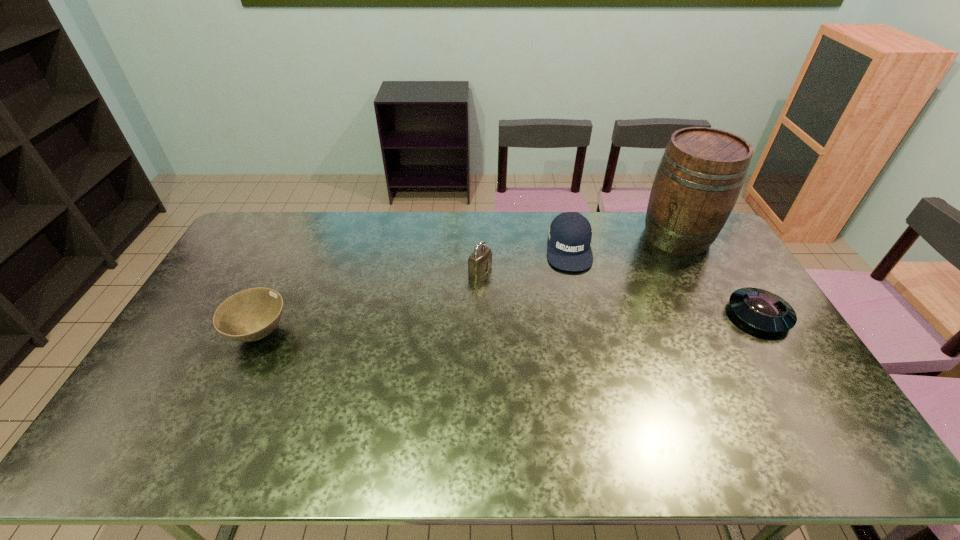
You are a GUI agent. You are given a task and a screenshot of the screen. Output one action in this format:
    pyautogui.click(x=<x>, y=<y>)
    Task: Click on the free space between the baseball cap and the cider
    
    Given the screenshot: What is the action you would take?
    pyautogui.click(x=623, y=242)

Where is `free spot between the padlock and the bowl`? The height and width of the screenshot is (540, 960). free spot between the padlock and the bowl is located at coordinates (370, 302).

This screenshot has width=960, height=540. Find the location of `unoccupied area between the padlock and the shortest object`. unoccupied area between the padlock and the shortest object is located at coordinates (619, 293).

I want to click on free space between the tallest object and the leftmost object, so click(468, 285).

Locate an element on the screen. The height and width of the screenshot is (540, 960). vacant space that is in between the shortest object and the tallest object is located at coordinates tap(718, 275).

Identify which object is the third closest to the shortest object. Please provide its 2D coordinates. Your answer should be formatted as a tuple, i.e. [(x, y)], where the tuple contains the x and y coordinates of a point satisfying the conditions above.

[(480, 260)]

Image resolution: width=960 pixels, height=540 pixels. In order to click on the third closest object relative to the shortest object in this screenshot , I will do `click(480, 260)`.

What are the coordinates of `free space in the image that satisfies the following two spatial constraints: 1. on the back side of the baseball cap; 2. on the left side of the tallest object` in the screenshot? It's located at 565,236.

At what (x,y) coordinates should I click in order to perform the action: click on blank area in the image that satisfies the following two spatial constraints: 1. on the back side of the baseball cap; 2. on the left side of the leftmost object. Please return your answer as a coordinate pair (x, y). This screenshot has height=540, width=960. Looking at the image, I should click on (300, 248).

You are a GUI agent. You are given a task and a screenshot of the screen. Output one action in this format:
    pyautogui.click(x=<x>, y=<y>)
    Task: Click on the blank area in the image that satisfies the following two spatial constraints: 1. on the front side of the shortest object; 2. on the left side of the cider
    This screenshot has width=960, height=540.
    Given the screenshot: What is the action you would take?
    pyautogui.click(x=719, y=315)